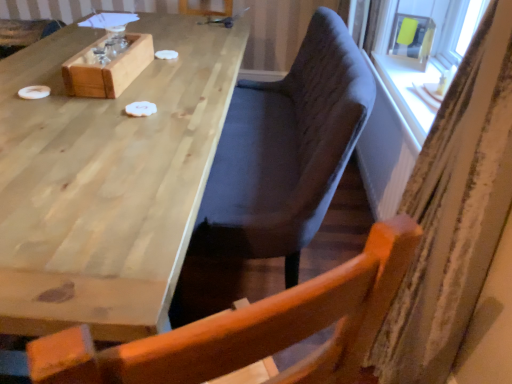
Question: Considering the positions of natural wood table at upper left and striped fabric curtain at right in the image, is natural wood table at upper left taller or shorter than striped fabric curtain at right?

Choices:
 (A) tall
 (B) short

Answer: (B)

Question: Is point coord(37,284) positioned closer to the camera than point coord(458,256)?

Choices:
 (A) closer
 (B) farther

Answer: (A)

Question: Which is nearer to the velvet dark blue chair at center?

Choices:
 (A) natural wood table at upper left
 (B) matte yellow plastic at upper right
 (C) striped fabric curtain at right

Answer: (A)

Question: Estimate the real-world distances between objects in this image. Which object is closer to the striped fabric curtain at right?

Choices:
 (A) velvet dark blue chair at center
 (B) natural wood table at upper left
 (C) matte yellow plastic at upper right

Answer: (A)